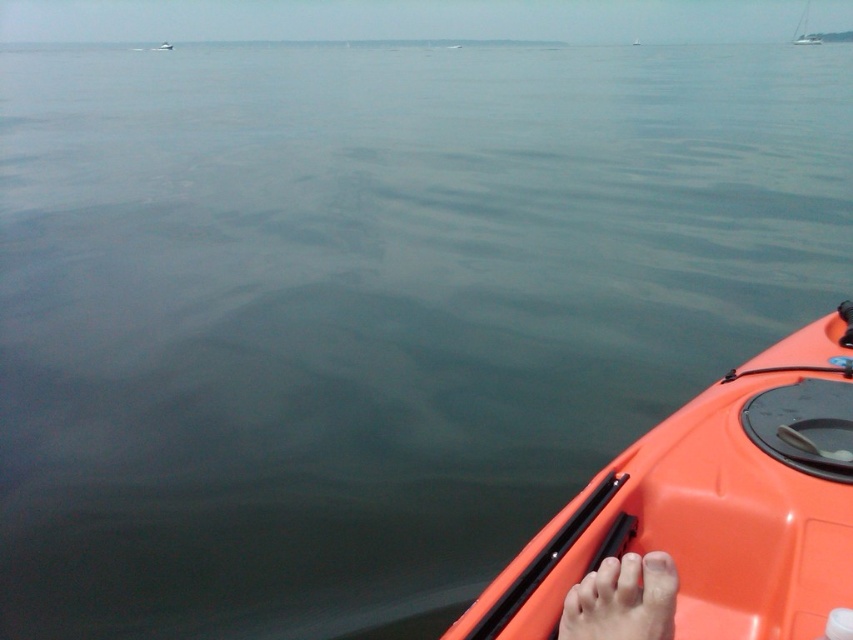
You are in an orange kayak on calm water. Your feet are at point [627,572]. You want to reach a floating dock that is 5.35 feet away from your current position. Can you safely reach it without capsizing the kayak?

Yes, since the distance between your feet at point [627,572] and the floating dock is 5.35 feet, which is a safe distance for reaching without capsizing the kayak.

You are a photographer trying to capture the orange plastic kayak at lower right and the skinny barefoot at lower right in the same frame. Based on their positions, which object appears closer to the camera?

The orange plastic kayak at lower right is above the skinny barefoot at lower right, so it appears closer to the camera.